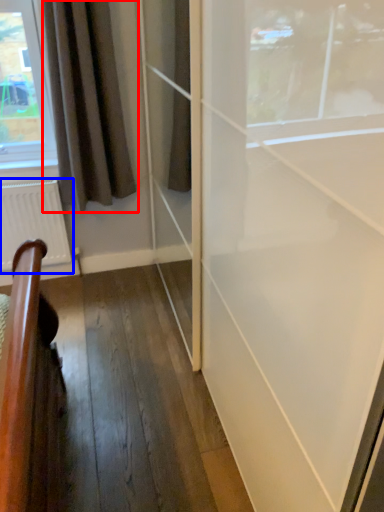
Question: Which object appears closest to the camera in this image, curtain (highlighted by a red box) or radiator (highlighted by a blue box)?

Choices:
 (A) curtain
 (B) radiator

Answer: (A)